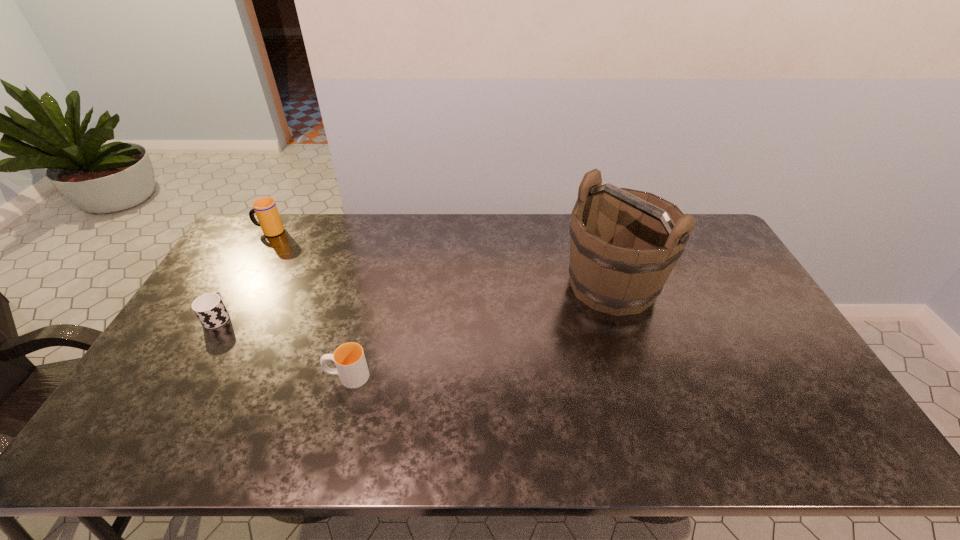
Find the location of a particular element. vacant region located 0.230m with the handle on the side of the third object from left to right is located at coordinates (238, 376).

The width and height of the screenshot is (960, 540). I want to click on free space located with the handle on the side of the third object from left to right, so click(288, 376).

The width and height of the screenshot is (960, 540). I want to click on vacant space located 0.380m on the side of the second farthest cup with the handle, so click(269, 231).

Find the location of a particular element. The image size is (960, 540). vacant area situated on the side of the second farthest cup with the handle is located at coordinates (257, 252).

Locate an element on the screen. vacant space situated 0.050m on the side of the second farthest cup with the handle is located at coordinates (232, 293).

Where is `bucket that is positioned at the far edge`? Image resolution: width=960 pixels, height=540 pixels. bucket that is positioned at the far edge is located at coordinates (624, 243).

Identify the location of cup that is at the far edge. (265, 208).

Locate an element on the screen. object at the far left corner is located at coordinates (265, 208).

In the image, there is a desktop. Identify the location of free region at the far edge. (538, 221).

In order to click on free location at the near edge of the desktop in this screenshot , I will do `click(199, 434)`.